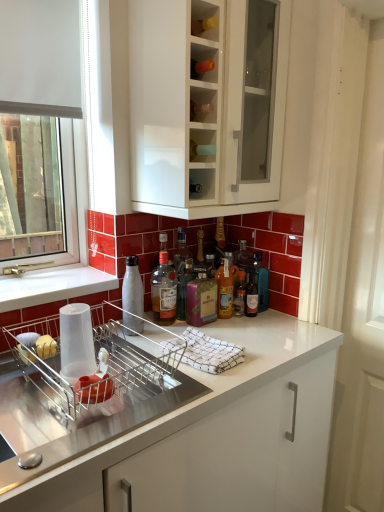
Find the location of a particular element. vacant space to the right of transparent plastic cup at sink is located at coordinates (152, 386).